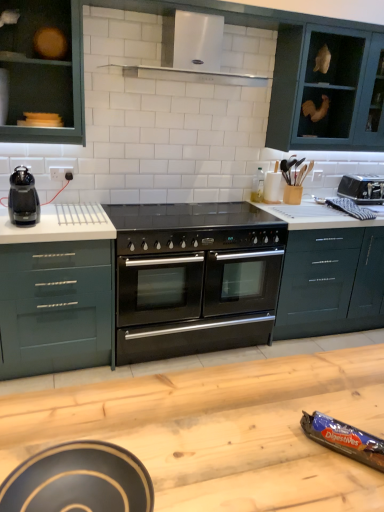
The height and width of the screenshot is (512, 384). In order to click on vacant region below black plastic coffee maker at left (from a real-world perspective) in this screenshot , I will do `click(35, 221)`.